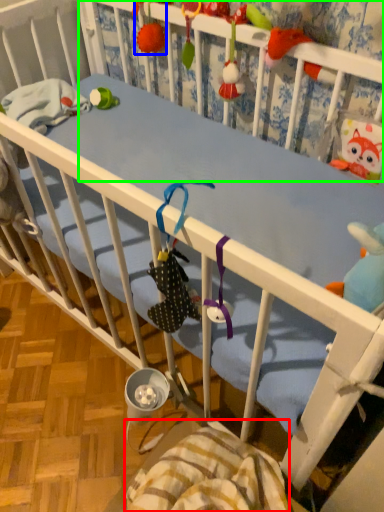
Question: Based on their relative distances, which object is farther from blanket (highlighted by a red box)? Choose from toy (highlighted by a blue box) and infant bed (highlighted by a green box).

Choices:
 (A) toy
 (B) infant bed

Answer: (A)